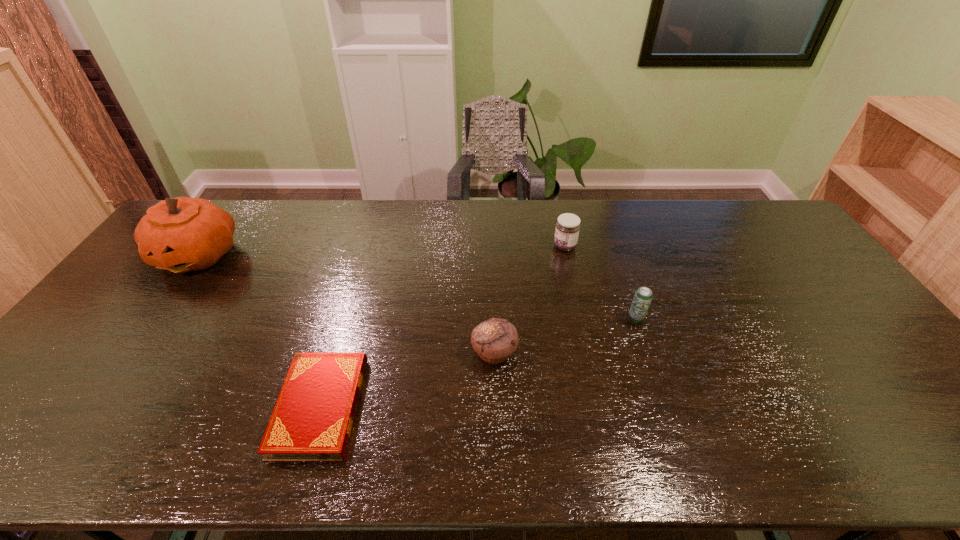
What are the coordinates of `free location at the near edge` in the screenshot? It's located at (468, 451).

In the image, there is a desktop. At what (x,y) coordinates should I click in order to perform the action: click on free space at the left edge. Please return your answer as a coordinate pair (x, y). The image size is (960, 540). Looking at the image, I should click on (163, 284).

You are a GUI agent. You are given a task and a screenshot of the screen. Output one action in this format:
    pyautogui.click(x=<x>, y=<y>)
    Task: Click on the free space at the right edge of the desktop
    
    Given the screenshot: What is the action you would take?
    pyautogui.click(x=768, y=244)

Where is `free region at the far right corner of the desktop`? The height and width of the screenshot is (540, 960). free region at the far right corner of the desktop is located at coordinates (769, 224).

The height and width of the screenshot is (540, 960). Identify the location of vacant space at the near right corner of the desktop. (904, 454).

Identify the location of vacant area between the rightmost object and the tallest object. (417, 287).

At what (x,y) coordinates should I click in order to perform the action: click on free space that is in between the beer can and the third object from left to right. Please return your answer as a coordinate pair (x, y). This screenshot has height=540, width=960. Looking at the image, I should click on (564, 336).

You are a GUI agent. You are given a task and a screenshot of the screen. Output one action in this format:
    pyautogui.click(x=<x>, y=<y>)
    Task: Click on the empty space that is in between the rightmost object and the second object from left to right
    The height and width of the screenshot is (540, 960).
    Given the screenshot: What is the action you would take?
    pyautogui.click(x=478, y=363)

This screenshot has height=540, width=960. I want to click on vacant region between the hardback book and the fourth object from left to right, so click(443, 327).

Find the location of a particular element. vacant area that lies between the shortest object and the pumpkin is located at coordinates pyautogui.click(x=259, y=330).